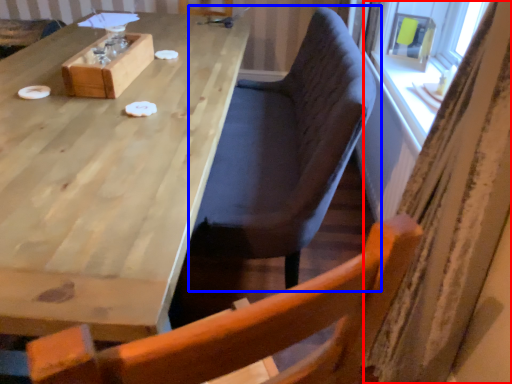
Question: Which object is further to the camera taking this photo, curtain (highlighted by a red box) or chair (highlighted by a blue box)?

Choices:
 (A) curtain
 (B) chair

Answer: (B)